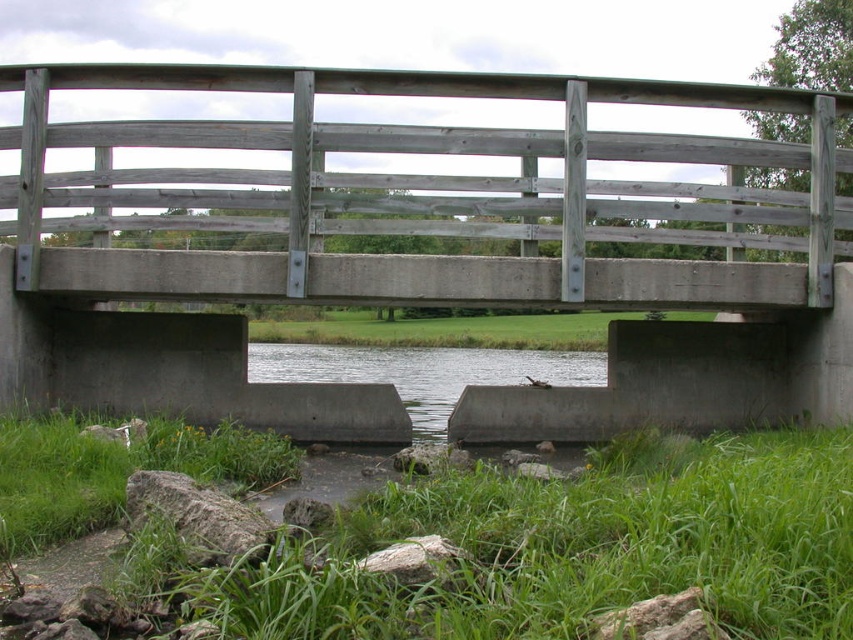
Does gray wooden bridge at center appear under gray concrete stream at center?

No.

Does point (650, 326) come behind point (578, 385)?

That is False.

This screenshot has height=640, width=853. In order to click on gray wooden bridge at center in this screenshot , I will do `click(425, 257)`.

Does point (410, 413) come farther from viewer compared to point (498, 316)?

No, (410, 413) is closer to viewer.

I want to click on gray concrete stream at center, so click(422, 372).

Is point (296, 372) positioned after point (357, 330)?

That is False.

Locate an element on the screen. gray concrete stream at center is located at coordinates (422, 372).

Who is taller, gray wooden bridge at center or green grass at lower left?

With more height is green grass at lower left.

Which is behind, point (728, 388) or point (569, 529)?

The point (728, 388) is behind.

Is point (221, 129) more distant than point (842, 547)?

Yes, point (221, 129) is farther from viewer.

The height and width of the screenshot is (640, 853). What are the coordinates of `gray wooden bridge at center` in the screenshot? It's located at (425, 257).